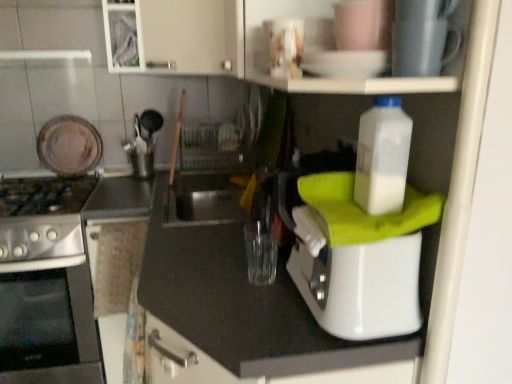
Question: Is metallic silver cup at upper center, the 1th appliance from the front, surrounded by stainless steel oven at left?

Choices:
 (A) yes
 (B) no

Answer: (B)

Question: Does stainless steel oven at left have a smaller size compared to metallic silver cup at upper center, positioned as the second appliance in back-to-front order?

Choices:
 (A) no
 (B) yes

Answer: (A)

Question: Can we say stainless steel oven at left lies outside metallic silver cup at upper center, positioned as the second appliance in back-to-front order?

Choices:
 (A) yes
 (B) no

Answer: (A)

Question: Are stainless steel oven at left and metallic silver cup at upper center, which appears as the 1th appliance when viewed from the right, making contact?

Choices:
 (A) yes
 (B) no

Answer: (B)

Question: From the image's perspective, does stainless steel oven at left appear higher than metallic silver cup at upper center, which appears as the 1th appliance when viewed from the right?

Choices:
 (A) no
 (B) yes

Answer: (A)

Question: Is point (x=379, y=196) closer or farther from the camera than point (x=70, y=190)?

Choices:
 (A) closer
 (B) farther

Answer: (A)

Question: Is white plastic bottle at upper right wider or thinner than stainless steel oven at left?

Choices:
 (A) wide
 (B) thin

Answer: (B)

Question: From a real-world perspective, is white plastic bottle at upper right positioned above or below stainless steel oven at left?

Choices:
 (A) above
 (B) below

Answer: (A)

Question: Is white plastic bottle at upper right taller or shorter than stainless steel oven at left?

Choices:
 (A) short
 (B) tall

Answer: (A)

Question: From a real-world perspective, relative to white matte cabinet at upper center, is metallic silver cup at upper center, positioned as the second appliance in back-to-front order, vertically above or below?

Choices:
 (A) above
 (B) below

Answer: (B)

Question: Visually, is metallic silver cup at upper center, positioned as the second appliance in back-to-front order, positioned to the left or to the right of white matte cabinet at upper center?

Choices:
 (A) right
 (B) left

Answer: (A)

Question: Do you think metallic silver cup at upper center, the 2th appliance from the left, is within white matte cabinet at upper center, or outside of it?

Choices:
 (A) inside
 (B) outside

Answer: (B)

Question: Is metallic silver cup at upper center, the 1th appliance from the front, wider or thinner than white matte cabinet at upper center?

Choices:
 (A) wide
 (B) thin

Answer: (B)

Question: Is white matte cabinet at upper center spatially inside white plastic bottle at upper right, or outside of it?

Choices:
 (A) outside
 (B) inside

Answer: (A)

Question: Is white matte cabinet at upper center to the left or to the right of white plastic bottle at upper right in the image?

Choices:
 (A) left
 (B) right

Answer: (A)